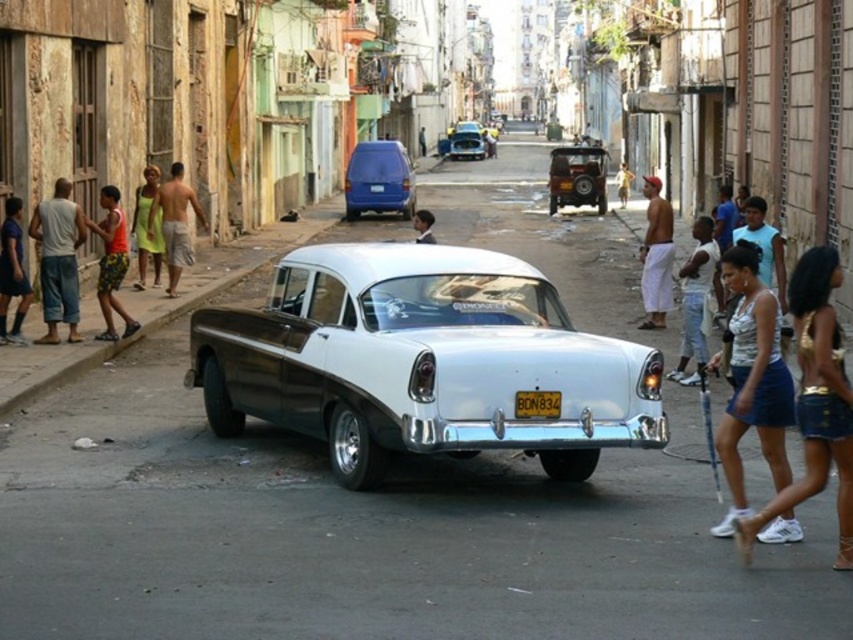
Question: Which point is closer to the camera?

Choices:
 (A) shiny blue car at center
 (B) matte blue van at center
 (C) smooth skin man at center

Answer: (B)

Question: Is the position of denim shorts at left more distant than that of camouflage shorts at left?

Choices:
 (A) yes
 (B) no

Answer: (B)

Question: Does dark blue denim shorts at left have a smaller size compared to smooth skin man at center?

Choices:
 (A) yes
 (B) no

Answer: (A)

Question: Which object appears closest to the camera in this image?

Choices:
 (A) white cotton shorts at right
 (B) shiny blue car at center
 (C) tan skin shirtless man at left

Answer: (A)

Question: Is tan skin shirtless man at left to the left of brown matte jeep at center from the viewer's perspective?

Choices:
 (A) no
 (B) yes

Answer: (B)

Question: Which point appears closest to the camera in this image?

Choices:
 (A) (688, 378)
 (B) (657, 179)
 (C) (106, 216)

Answer: (A)